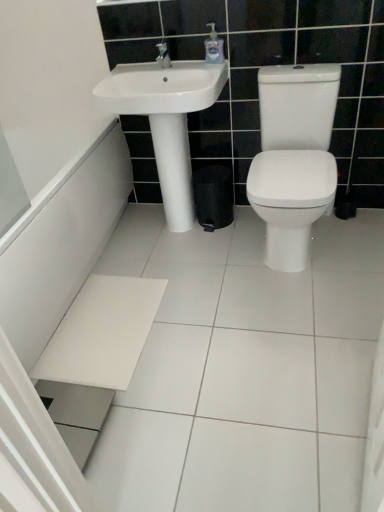
Question: Is white glossy bath at lower left outside of white ceramic tile at lower center?

Choices:
 (A) no
 (B) yes

Answer: (B)

Question: Is white glossy bath at lower left far from white ceramic tile at lower center?

Choices:
 (A) yes
 (B) no

Answer: (B)

Question: From the image's perspective, is white glossy bath at lower left on top of white ceramic tile at lower center?

Choices:
 (A) yes
 (B) no

Answer: (A)

Question: Is white glossy bath at lower left wider than white ceramic tile at lower center?

Choices:
 (A) yes
 (B) no

Answer: (B)

Question: Is white ceramic tile at lower center at the back of white glossy bath at lower left?

Choices:
 (A) no
 (B) yes

Answer: (A)

Question: Considering the positions of clear plastic soap dispenser at upper center and white glossy bath at lower left in the image, is clear plastic soap dispenser at upper center taller or shorter than white glossy bath at lower left?

Choices:
 (A) tall
 (B) short

Answer: (B)

Question: From a real-world perspective, is clear plastic soap dispenser at upper center physically located above or below white glossy bath at lower left?

Choices:
 (A) above
 (B) below

Answer: (A)

Question: Based on their positions, is clear plastic soap dispenser at upper center located to the left or right of white glossy bath at lower left?

Choices:
 (A) left
 (B) right

Answer: (B)

Question: Considering the positions of clear plastic soap dispenser at upper center and white glossy bath at lower left in the image, is clear plastic soap dispenser at upper center wider or thinner than white glossy bath at lower left?

Choices:
 (A) wide
 (B) thin

Answer: (B)

Question: Considering the positions of point (19, 247) and point (213, 40), is point (19, 247) closer or farther from the camera than point (213, 40)?

Choices:
 (A) farther
 (B) closer

Answer: (B)

Question: In the image, is white glossy bath at lower left positioned in front of or behind clear plastic soap dispenser at upper center?

Choices:
 (A) behind
 (B) front

Answer: (B)

Question: In terms of size, does white glossy bath at lower left appear bigger or smaller than clear plastic soap dispenser at upper center?

Choices:
 (A) big
 (B) small

Answer: (A)

Question: In terms of height, does white glossy bath at lower left look taller or shorter compared to clear plastic soap dispenser at upper center?

Choices:
 (A) short
 (B) tall

Answer: (B)

Question: Considering the positions of point (210, 392) and point (205, 53), is point (210, 392) closer or farther from the camera than point (205, 53)?

Choices:
 (A) farther
 (B) closer

Answer: (B)

Question: In the image, is white ceramic tile at lower center positioned in front of or behind clear plastic soap dispenser at upper center?

Choices:
 (A) behind
 (B) front

Answer: (B)